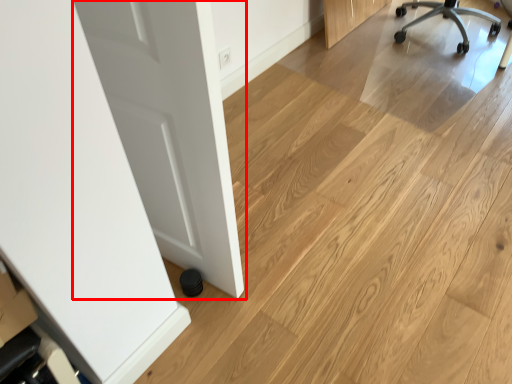
Question: From the image's perspective, where is door (annotated by the red box) located in relation to chair in the image?

Choices:
 (A) below
 (B) above

Answer: (A)